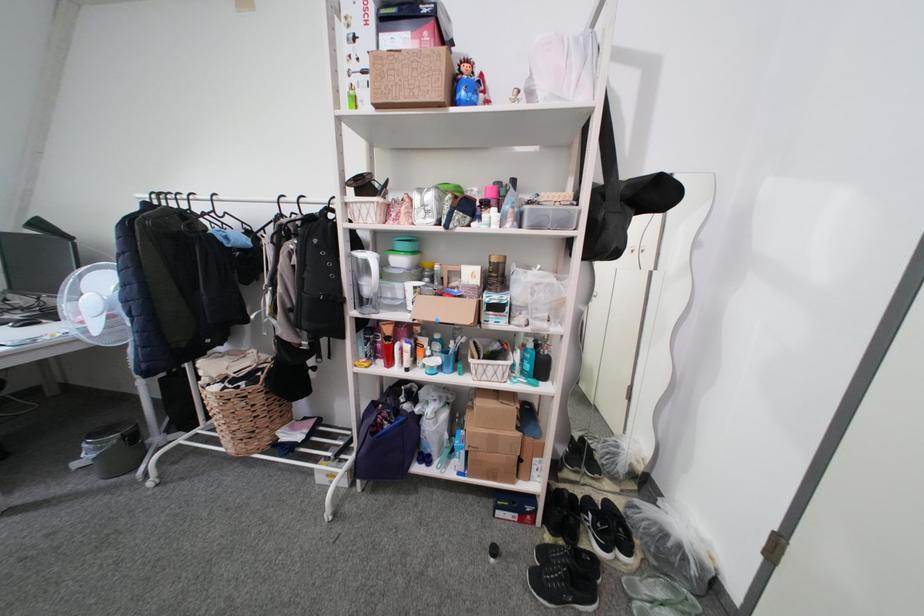
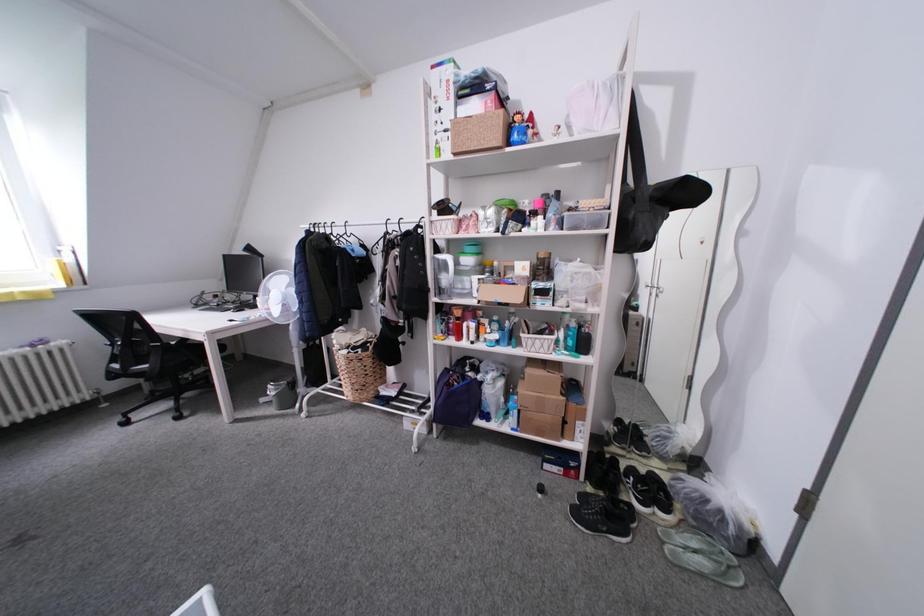
Question: The first image is from the beginning of the video and the second image is from the end. How did the camera likely rotate when shooting the video?

Choices:
 (A) Left
 (B) Right
 (C) Up
 (D) Down

Answer: (A)